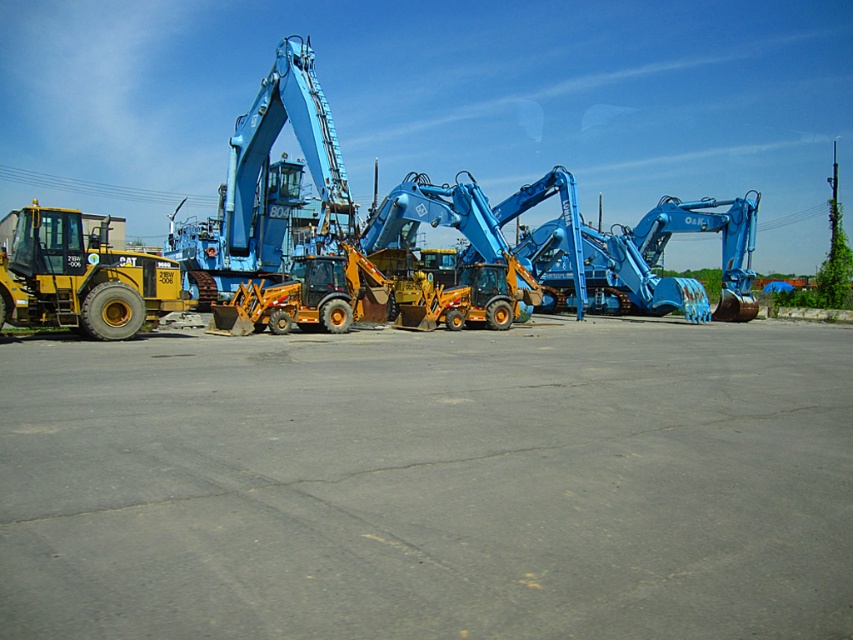
You are a delivery driver who needs to park your truck in an area that can accommodate its size. Based on the scene, which object between the gray asphalt parking lot at center and the matte blue excavator at center would you choose to park your truck next to?

The matte blue excavator at center is larger than the gray asphalt parking lot at center, so you should park next to the matte blue excavator at center because it has more space available.

You are standing at point 0.5, 0.5 in the image. Which direction should you move to reach the gray asphalt parking lot at center?

The gray asphalt parking lot at center is located at point (430,483). Since you are at point (426,320), you should move to the right to reach it.